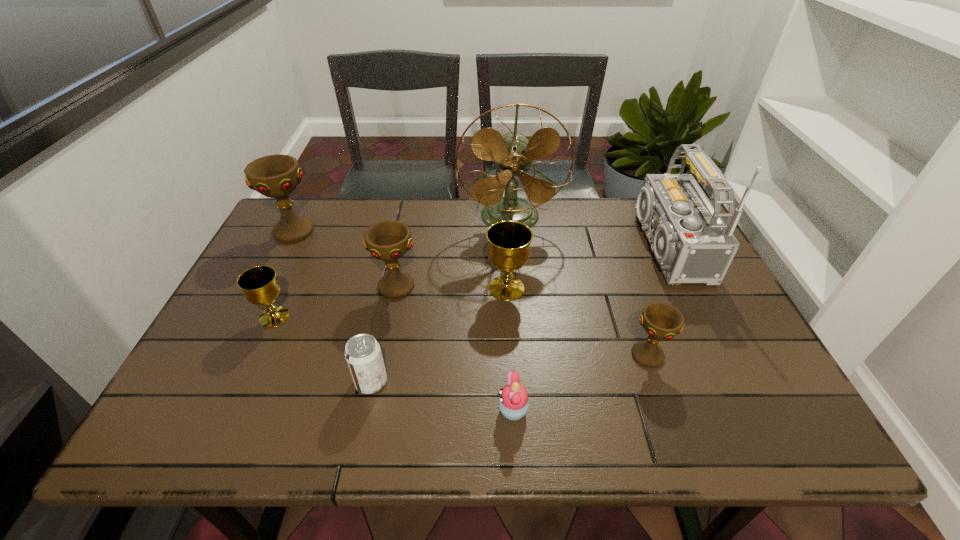
This screenshot has height=540, width=960. What are the coordinates of `free space between the soda can and the fan` in the screenshot? It's located at (441, 299).

Identify the location of free area in between the third chalice from right to left and the shortest object. This screenshot has width=960, height=540. (455, 348).

Image resolution: width=960 pixels, height=540 pixels. I want to click on free spot between the shortest object and the bigger gold chalice, so click(x=510, y=349).

Locate an element on the screen. The height and width of the screenshot is (540, 960). empty space that is in between the radio receiver and the second red chalice from right to left is located at coordinates (529, 267).

At what (x,y) coordinates should I click in order to perform the action: click on free space between the biggest red chalice and the sixth farthest object. Please return your answer as a coordinate pair (x, y). Image resolution: width=960 pixels, height=540 pixels. Looking at the image, I should click on (284, 274).

Find the location of `free space between the right gold chalice and the left gold chalice`. free space between the right gold chalice and the left gold chalice is located at coordinates (391, 302).

Locate an element on the screen. The width and height of the screenshot is (960, 540). empty location between the gray radio receiver and the soda can is located at coordinates (516, 314).

Find the location of `free space between the second chalice from right to left and the tallest chalice`. free space between the second chalice from right to left and the tallest chalice is located at coordinates (400, 260).

Identify the location of object that is the nearest to the sixth farthest object. This screenshot has height=540, width=960. (388, 240).

Identify the location of the closest object relative to the bigger gold chalice. The image size is (960, 540). (513, 152).